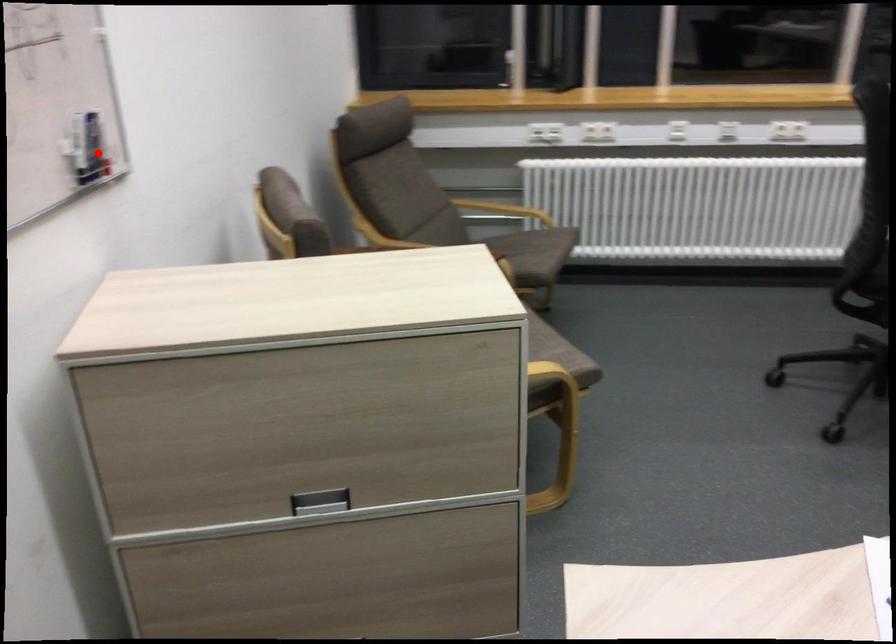
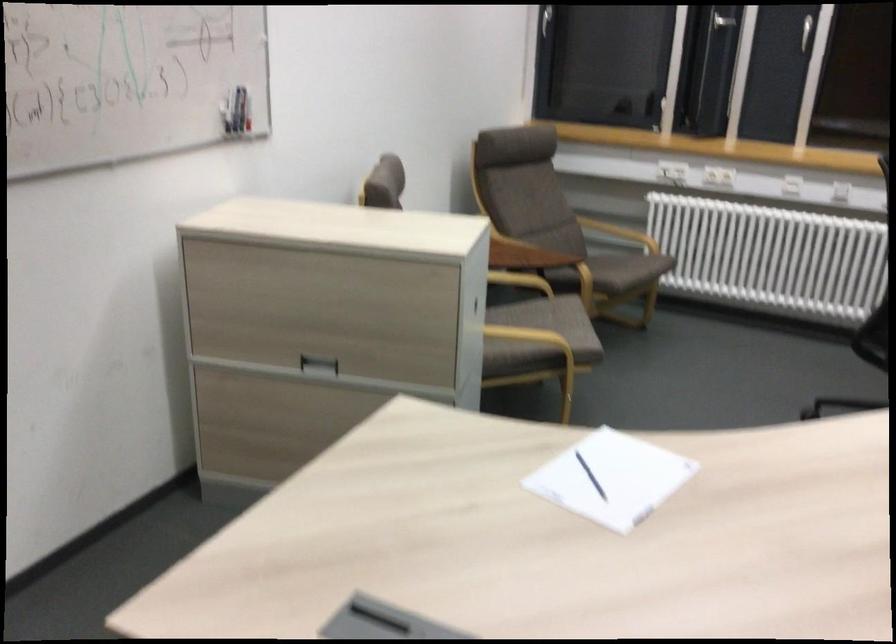
Question: A red point is marked in image1. In image2, is the corresponding 3D point closer to the camera or farther? Reply with the corresponding letter.

Choices:
 (A) The corresponding 3D point is closer.
 (B) The corresponding 3D point is farther.

Answer: (B)